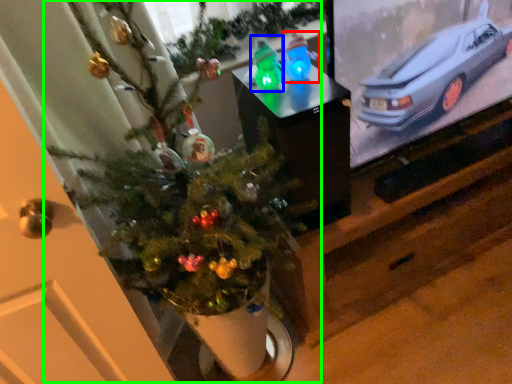
Question: Which object is positioned closest to toy (highlighted by a red box)? Select from toy (highlighted by a blue box) and christmas tree (highlighted by a green box).

Choices:
 (A) toy
 (B) christmas tree

Answer: (A)